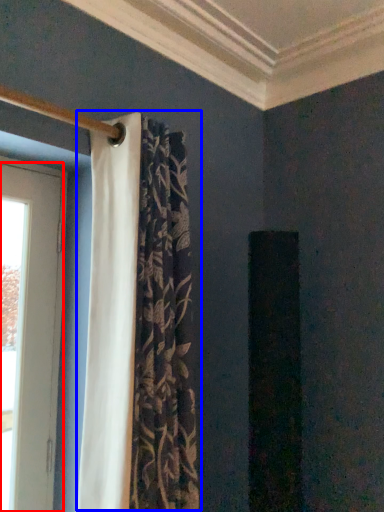
Question: Which object appears closest to the camera in this image, door (highlighted by a red box) or curtain (highlighted by a blue box)?

Choices:
 (A) door
 (B) curtain

Answer: (B)